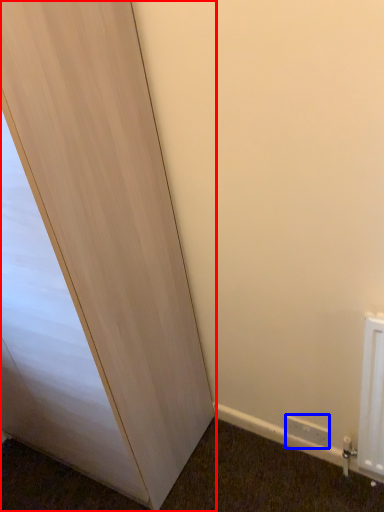
Question: Which object appears farthest to the camera in this image, door (highlighted by a red box) or electric outlet (highlighted by a blue box)?

Choices:
 (A) door
 (B) electric outlet

Answer: (B)